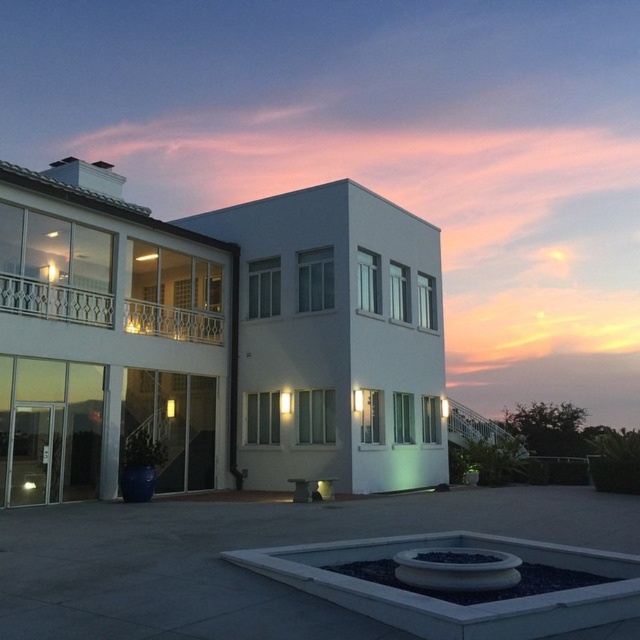
You are standing at the entrance of the white smooth villa at center. From your position, which direction would you face to look towards the balcony on the upper level?

The white smooth villa at center is located at point [221,336], so the balcony on the upper level is part of the villa and would be above your current position. You should look upwards to face the balcony.

You are a delivery person approaching the white smooth villa at center and the transparent glass door at lower left. Which object is closer to the front entrance of the building?

The transparent glass door at lower left is closer to the front entrance of the building because the white smooth villa at center is positioned over it, meaning the door is in front.